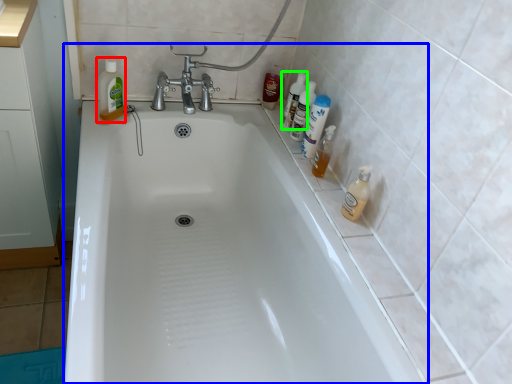
Question: Which object is positioned farthest from cleaning product (highlighted by a red box)? Select from bathtub (highlighted by a blue box) and cleaning product (highlighted by a green box).

Choices:
 (A) bathtub
 (B) cleaning product

Answer: (B)